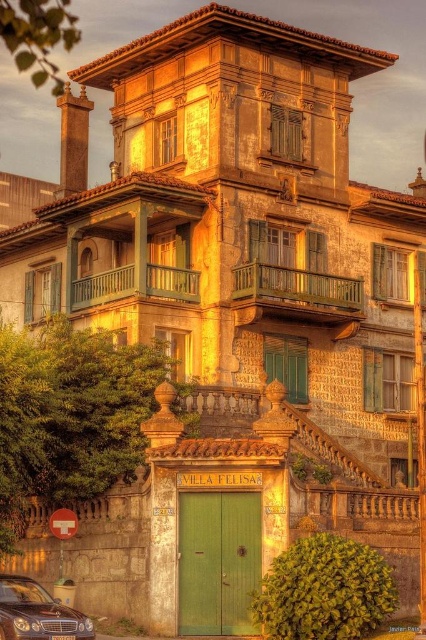
Is the position of shiny dark brown car at lower left less distant than that of wooden balcony at center?

Yes, it is in front of wooden balcony at center.

Which is in front, point (31, 625) or point (95, 291)?

Point (31, 625) is more forward.

You are a GUI agent. You are given a task and a screenshot of the screen. Output one action in this format:
    pyautogui.click(x=<x>, y=<y>)
    Task: Click on the shiny dark brown car at lower left
    This screenshot has width=426, height=640.
    Given the screenshot: What is the action you would take?
    pyautogui.click(x=37, y=612)

Which is in front, point (353, 292) or point (2, 612)?

Positioned in front is point (2, 612).

Is point (268, 275) closer to camera compared to point (19, 612)?

No, (268, 275) is further to viewer.

Who is more forward, (x=293, y=280) or (x=20, y=589)?

Positioned in front is point (x=20, y=589).

Find the location of `green wooden balcony at center`. green wooden balcony at center is located at coordinates (294, 294).

Who is positioned more to the right, green wooden balcony at center or wooden balcony at center?

Positioned to the right is green wooden balcony at center.

Is point (250, 289) closer to camera compared to point (86, 305)?

Yes, it is in front of point (86, 305).

Who is more distant from viewer, (x=301, y=280) or (x=144, y=282)?

Positioned behind is point (x=301, y=280).

At what (x,y) coordinates should I click in order to perform the action: click on green wooden balcony at center. Please return your answer as a coordinate pair (x, y). Looking at the image, I should click on (294, 294).